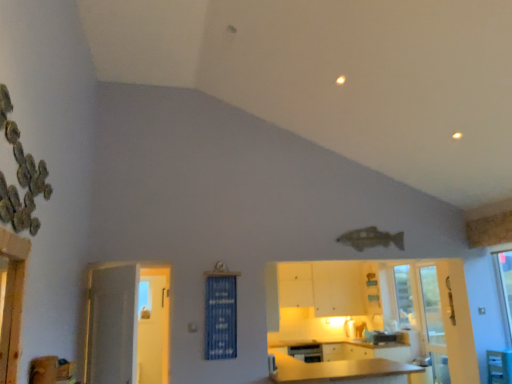
Question: Would you say matte wood cabinetry at center, which is the first cabinetry from front to back, is inside or outside white glossy door at left?

Choices:
 (A) outside
 (B) inside

Answer: (A)

Question: Relative to white glossy door at left, is matte wood cabinetry at center, which is the first cabinetry from front to back, in front or behind?

Choices:
 (A) behind
 (B) front

Answer: (B)

Question: Considering the real-world distances, which object is farthest from the yellow matte dishwasher at lower center?

Choices:
 (A) green plastic table at lower right
 (B) clear glass screen door at lower right
 (C) white glossy cabinets at center, which is the 1th cabinetry in back-to-front order
 (D) blue fabric curtain at center
 (E) white glossy door at left

Answer: (A)

Question: Which object is the closest to the white glossy cabinets at center, the second cabinetry in the front-to-back sequence?

Choices:
 (A) matte wood cabinetry at center, which is the 2th cabinetry in back-to-front order
 (B) green plastic table at lower right
 (C) white glossy door at left
 (D) yellow matte dishwasher at lower center
 (E) blue fabric curtain at center

Answer: (A)